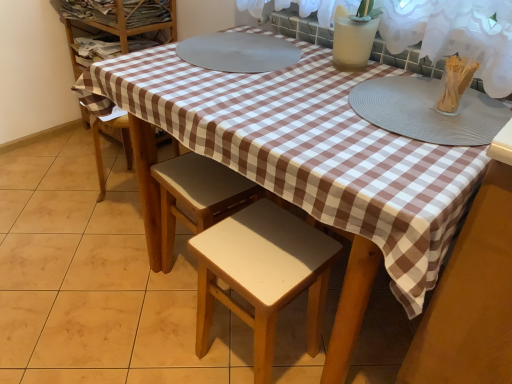
This screenshot has width=512, height=384. Identify the location of vacant area situated to the left side of clear plastic container at upper right. (388, 107).